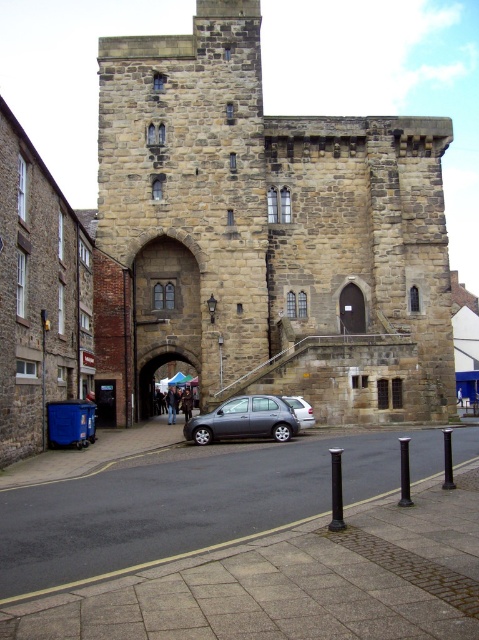
Locate an element on the screen. dark brown leather jacket at center is located at coordinates (186, 403).

Can you confirm if dark brown leather jacket at center is positioned below white fabric umbrella at center?

Indeed, dark brown leather jacket at center is positioned under white fabric umbrella at center.

Does point (191, 406) lie behind point (177, 376)?

No.

Locate an element on the screen. The height and width of the screenshot is (640, 479). dark brown leather jacket at center is located at coordinates (186, 403).

Between stone archway at center and dark brown stone archway at center, which one is positioned higher?

dark brown stone archway at center is above.

Does point (149, 385) come closer to viewer compared to point (362, 308)?

No, it is behind (362, 308).

Describe the element at coordinates (155, 372) in the screenshot. Image resolution: width=479 pixels, height=640 pixels. I see `stone archway at center` at that location.

The image size is (479, 640). I want to click on stone archway at center, so click(x=155, y=372).

Is dark brown stone archway at center positioned in front of white fabric umbrella at center?

Yes, dark brown stone archway at center is closer to the viewer.

Which is in front, point (358, 307) or point (179, 376)?

Point (358, 307) is in front.

Identify the location of dark brown stone archway at center. The width and height of the screenshot is (479, 640). [352, 308].